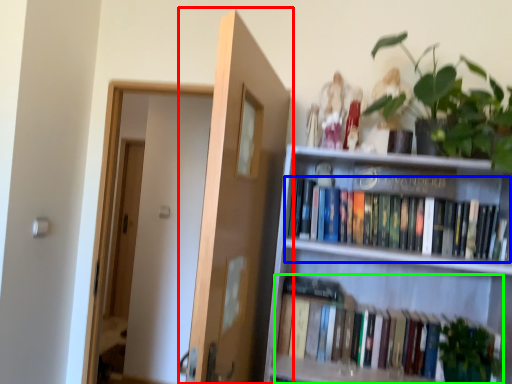
Question: Which object is the closest to the door (highlighted by a red box)? Choose among these: book (highlighted by a blue box) or book (highlighted by a green box).

Choices:
 (A) book
 (B) book

Answer: (B)